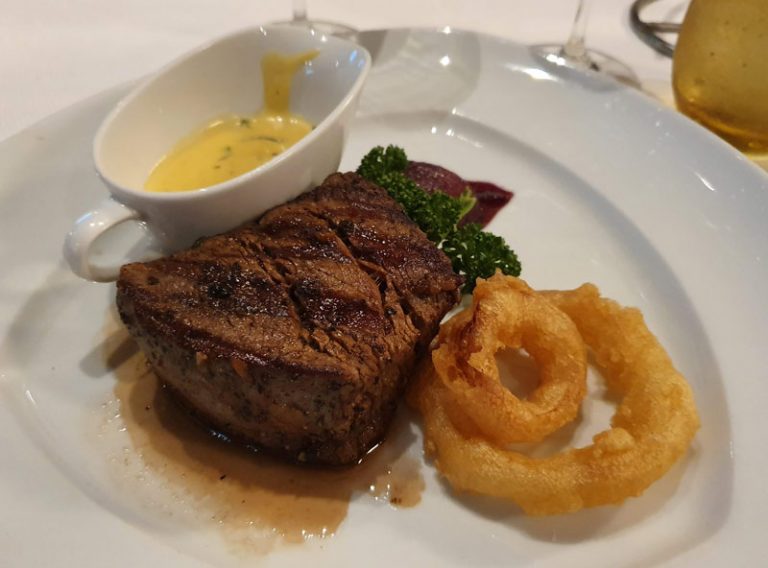
Where is `wine glass stem to hold`? The image size is (768, 568). wine glass stem to hold is located at coordinates (576, 39).